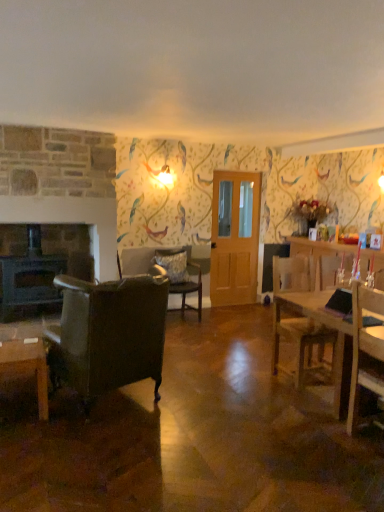
Question: Should I look upward or downward to see velvet dark green armchair at center, which appears as the 2th chair when viewed from the right?

Choices:
 (A) up
 (B) down

Answer: (B)

Question: Does fluffy gray pillow at center lie in front of wooden chair at right, positioned as the first chair in right-to-left order?

Choices:
 (A) no
 (B) yes

Answer: (A)

Question: Could you tell me if fluffy gray pillow at center is turned towards wooden chair at right, positioned as the third chair in left-to-right order?

Choices:
 (A) yes
 (B) no

Answer: (A)

Question: Is the position of fluffy gray pillow at center more distant than that of wooden chair at right, the 2th chair positioned from the back?

Choices:
 (A) no
 (B) yes

Answer: (B)

Question: Does fluffy gray pillow at center have a greater height compared to wooden chair at right, positioned as the first chair in right-to-left order?

Choices:
 (A) yes
 (B) no

Answer: (B)

Question: Is fluffy gray pillow at center looking in the opposite direction of wooden chair at right, the 2th chair in the front-to-back sequence?

Choices:
 (A) no
 (B) yes

Answer: (A)

Question: From the image's perspective, is fluffy gray pillow at center over wooden chair at right, positioned as the first chair in right-to-left order?

Choices:
 (A) no
 (B) yes

Answer: (B)

Question: Is fluffy gray pillow at center a part of velvet dark green armchair at center, which appears as the 2th chair when viewed from the right?

Choices:
 (A) yes
 (B) no

Answer: (A)

Question: Considering the relative positions of velvet dark green armchair at center, positioned as the 3th chair in front-to-back order, and fluffy gray pillow at center in the image provided, is velvet dark green armchair at center, positioned as the 3th chair in front-to-back order, to the left of fluffy gray pillow at center from the viewer's perspective?

Choices:
 (A) no
 (B) yes

Answer: (A)

Question: From the image's perspective, is velvet dark green armchair at center, which appears as the 2th chair when viewed from the right, over fluffy gray pillow at center?

Choices:
 (A) yes
 (B) no

Answer: (B)

Question: Would you say velvet dark green armchair at center, marked as the 2th chair in a left-to-right arrangement, is outside fluffy gray pillow at center?

Choices:
 (A) yes
 (B) no

Answer: (A)

Question: From a real-world perspective, is velvet dark green armchair at center, marked as the 2th chair in a left-to-right arrangement, physically above fluffy gray pillow at center?

Choices:
 (A) yes
 (B) no

Answer: (B)

Question: Is velvet dark green armchair at center, which is counted as the 1th chair, starting from the back, positioned behind fluffy gray pillow at center?

Choices:
 (A) yes
 (B) no

Answer: (B)

Question: Can you confirm if wooden table at right is wider than clear glass door at center?

Choices:
 (A) no
 (B) yes

Answer: (B)